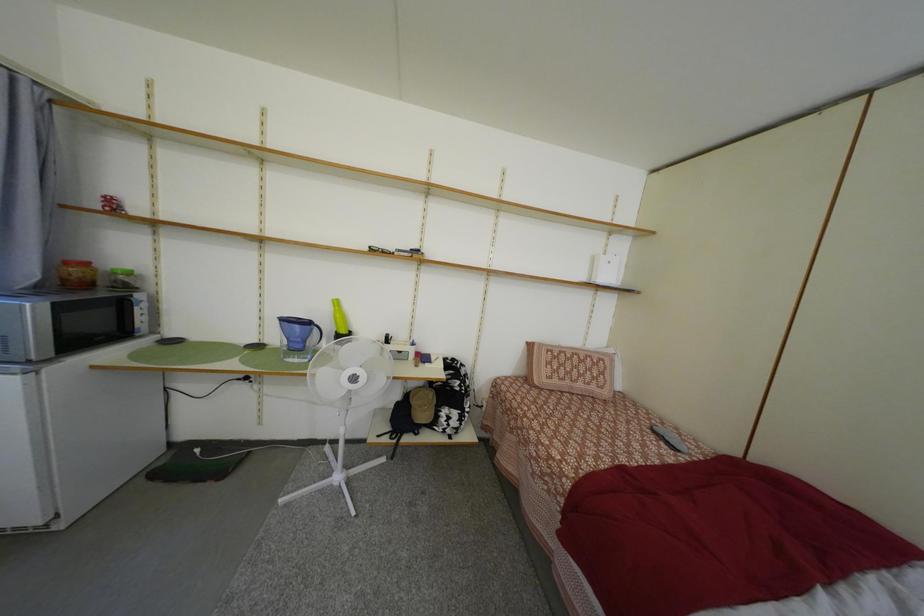
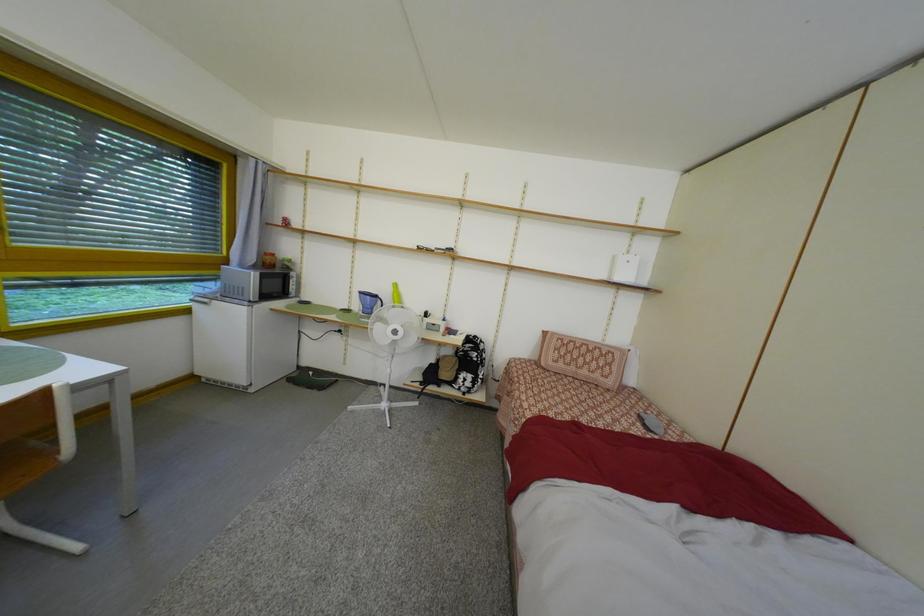
Question: The first image is from the beginning of the video and the second image is from the end. How did the camera likely rotate when shooting the video?

Choices:
 (A) Left
 (B) Right
 (C) Up
 (D) Down

Answer: (A)